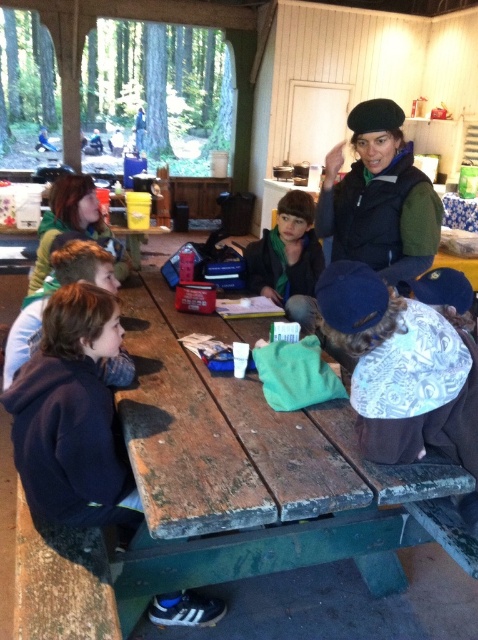
Which is more to the right, wooden picnic table at center or dark blue hoodie at lower left?

wooden picnic table at center

Is point (445, 470) closer to viewer compared to point (67, 497)?

Yes, point (445, 470) is closer to viewer.

At what (x,y) coordinates should I click in order to perform the action: click on wooden picnic table at center. Please return your answer as a coordinate pair (x, y). Looking at the image, I should click on (241, 438).